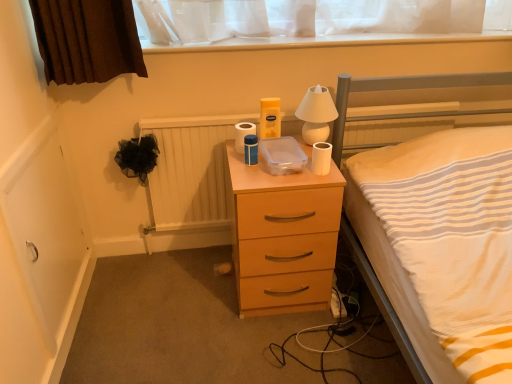
Find the location of `space that is in front of white matte toilet paper at right, the 1th toilet paper positioned from the right`. space that is in front of white matte toilet paper at right, the 1th toilet paper positioned from the right is located at coordinates (320, 179).